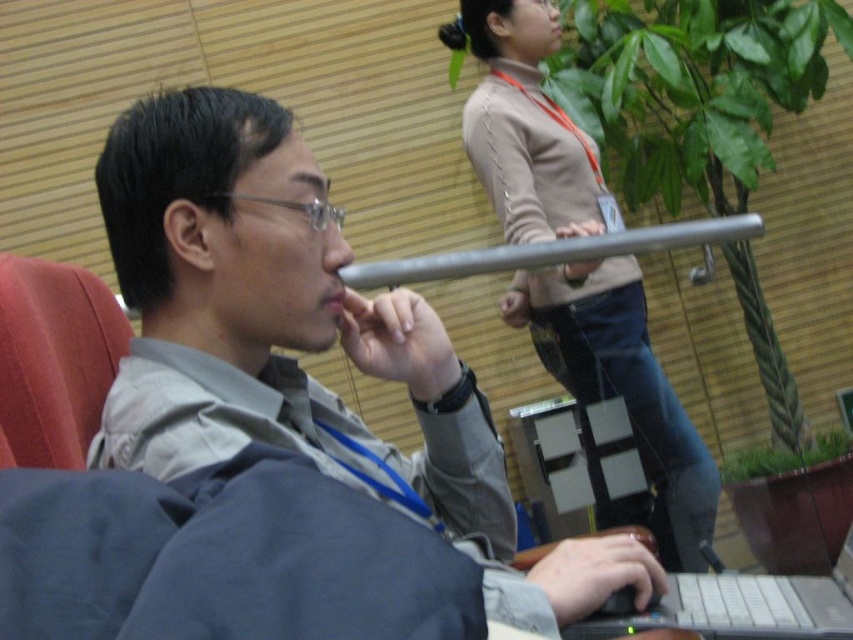
Question: Which point is closer to the camera?

Choices:
 (A) (241, 170)
 (B) (817, 614)

Answer: (A)

Question: Is gray fabric shirt at center in front of black plastic laptop at lower right?

Choices:
 (A) yes
 (B) no

Answer: (A)

Question: Among these objects, which one is nearest to the camera?

Choices:
 (A) gray fabric shirt at center
 (B) black plastic laptop at lower right
 (C) beige sweater at upper center

Answer: (A)

Question: Which point is farther from the camera taking this photo?

Choices:
 (A) (509, 586)
 (B) (662, 419)

Answer: (B)

Question: Does beige sweater at upper center appear on the right side of black plastic laptop at lower right?

Choices:
 (A) no
 (B) yes

Answer: (A)

Question: Does beige sweater at upper center lie in front of black plastic laptop at lower right?

Choices:
 (A) yes
 (B) no

Answer: (B)